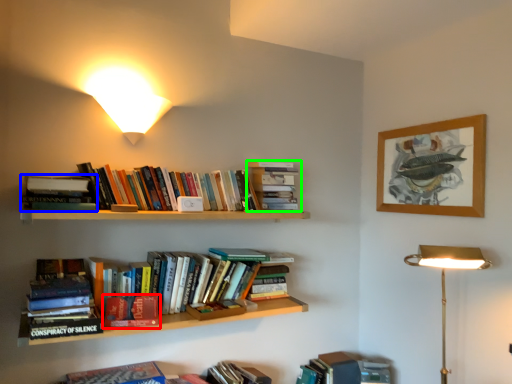
Question: Which is farther away from book (highlighted by a red box)? book (highlighted by a blue box) or book (highlighted by a green box)?

Choices:
 (A) book
 (B) book

Answer: (B)